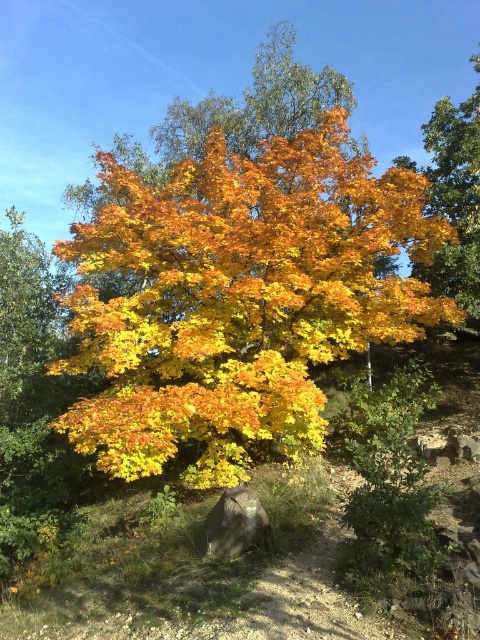
Between golden yellow leaves at center and gray rough rock at lower center, which one appears on the right side from the viewer's perspective?

gray rough rock at lower center is more to the right.

Does golden yellow leaves at center come behind gray rough rock at lower center?

Yes, golden yellow leaves at center is further from the viewer.

Where is `golden yellow leaves at center`? golden yellow leaves at center is located at coordinates tap(240, 298).

This screenshot has height=640, width=480. I want to click on golden yellow leaves at center, so click(240, 298).